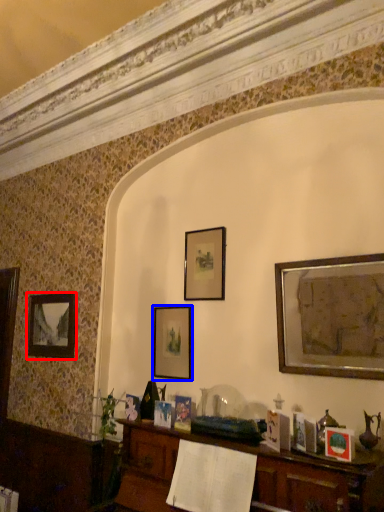
Question: Which of the following is the closest to the observer, picture frame (highlighted by a red box) or picture frame (highlighted by a blue box)?

Choices:
 (A) picture frame
 (B) picture frame

Answer: (B)